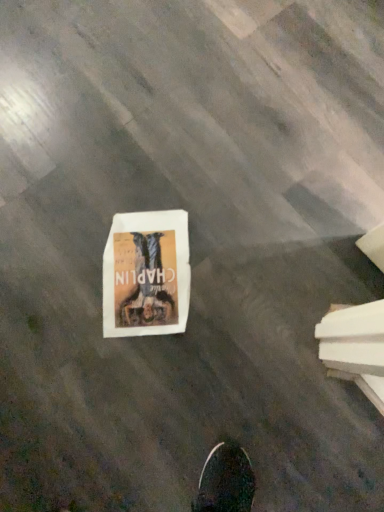
The height and width of the screenshot is (512, 384). Find the location of `empty space that is ontop of white paper comic book at center (from a real-world perspective)`. empty space that is ontop of white paper comic book at center (from a real-world perspective) is located at coordinates (142, 253).